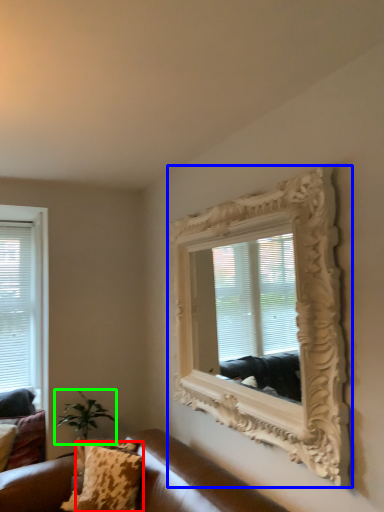
Question: Which object is the farthest from pillow (highlighted by a red box)? Choose among these: picture frame (highlighted by a blue box) or houseplant (highlighted by a green box).

Choices:
 (A) picture frame
 (B) houseplant

Answer: (A)